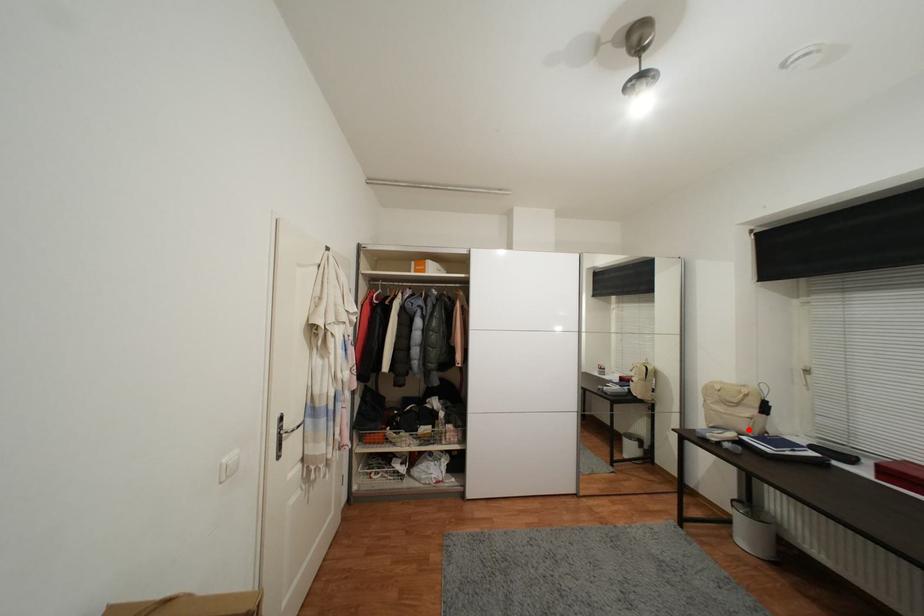
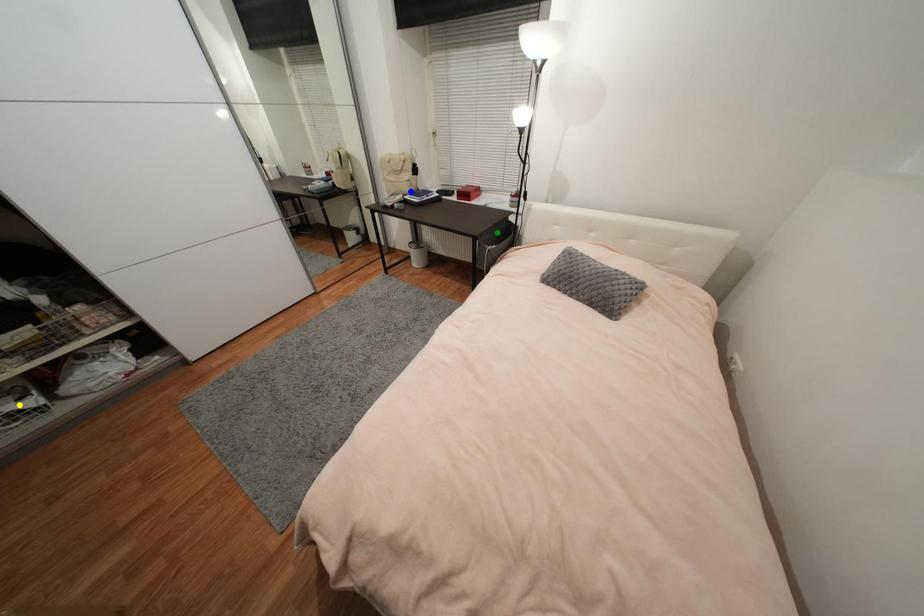
Question: I am providing you with two images of the same scene from different viewpoints. A red point is marked on the first image. You are given multiple points on the second image. Which point in image 2 represents the same 3d spot as the red point in image 1?

Choices:
 (A) yellow point
 (B) green point
 (C) blue point

Answer: (C)